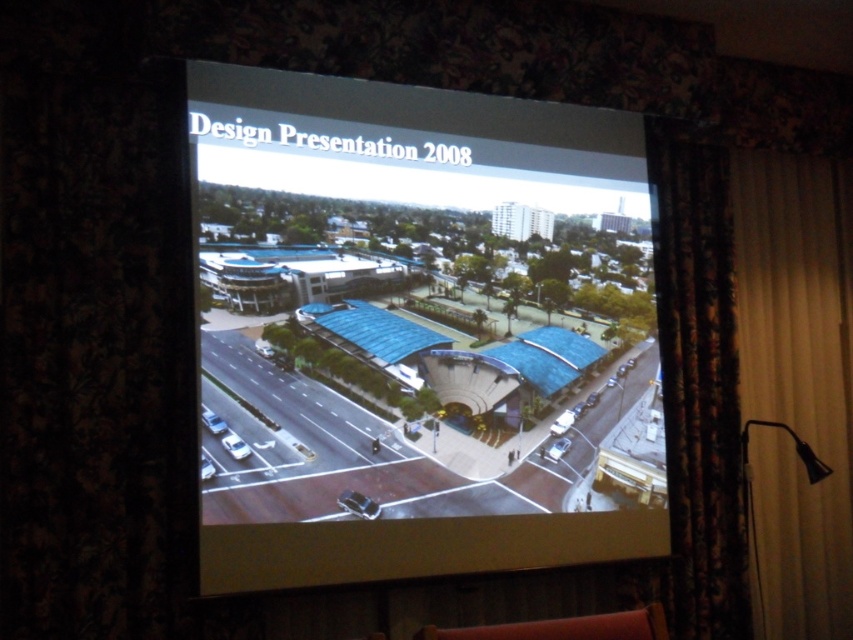
Question: Is white fabric curtain at right thinner than metallic silver car at lower left?

Choices:
 (A) yes
 (B) no

Answer: (B)

Question: Which point appears closest to the camera in this image?

Choices:
 (A) (206, 420)
 (B) (843, 592)
 (C) (236, 442)

Answer: (A)

Question: Can you confirm if white fabric curtain at right is thinner than metallic silver car at lower left?

Choices:
 (A) yes
 (B) no

Answer: (B)

Question: Which point appears closest to the camera in this image?

Choices:
 (A) (672, 220)
 (B) (206, 468)
 (C) (223, 436)

Answer: (B)

Question: Can you confirm if transparent glass screen at center is positioned below white glossy car at lower left?

Choices:
 (A) yes
 (B) no

Answer: (B)

Question: Among these objects, which one is nearest to the camera?

Choices:
 (A) transparent glass screen at center
 (B) white fabric curtain at right
 (C) metallic silver car at lower left

Answer: (A)